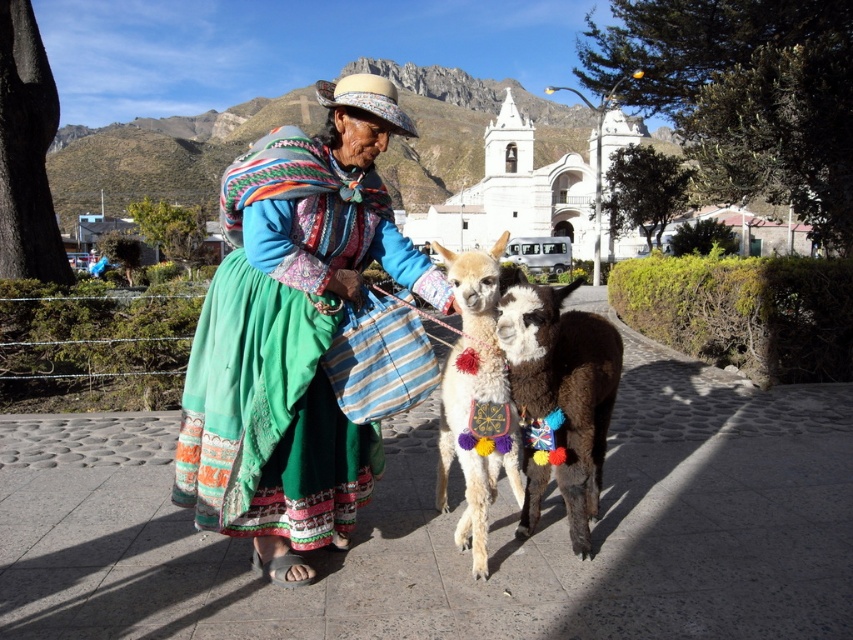
Question: Based on their relative distances, which object is farther from the matte green skirt at center?

Choices:
 (A) soft brown woolen camel at center
 (B) fluffy white alpaca at center

Answer: (A)

Question: Is matte green skirt at center to the right of fluffy white alpaca at center from the viewer's perspective?

Choices:
 (A) no
 (B) yes

Answer: (A)

Question: Which point is closer to the camera taking this photo?

Choices:
 (A) (532, 353)
 (B) (221, 307)
 (C) (451, 353)

Answer: (A)

Question: Is the position of matte green skirt at center more distant than that of fluffy white alpaca at center?

Choices:
 (A) no
 (B) yes

Answer: (A)

Question: Which object is the farthest from the matte green skirt at center?

Choices:
 (A) fluffy white alpaca at center
 (B) soft brown woolen camel at center

Answer: (B)

Question: Is matte green skirt at center above fluffy white alpaca at center?

Choices:
 (A) no
 (B) yes

Answer: (B)